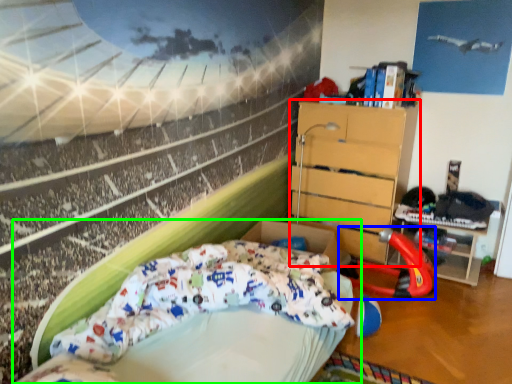
Question: Considering the real-world distances, which object is farthest from chest of drawers (highlighted by a red box)? sport equipment (highlighted by a blue box) or bed (highlighted by a green box)?

Choices:
 (A) sport equipment
 (B) bed

Answer: (B)